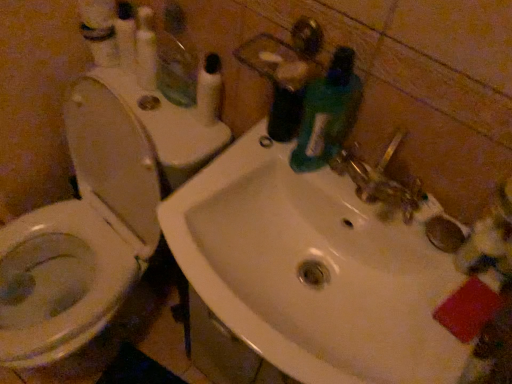
Question: In the image, is white plastic pump at upper center on the left side or the right side of clear glass mirror at upper left?

Choices:
 (A) left
 (B) right

Answer: (B)

Question: Considering the positions of point (217, 86) and point (158, 72), is point (217, 86) closer or farther from the camera than point (158, 72)?

Choices:
 (A) farther
 (B) closer

Answer: (B)

Question: Estimate the real-world distances between objects in this image. Which object is farther from the white plastic pump at upper center?

Choices:
 (A) green rubber gloves at sink
 (B) white glossy toilet at left
 (C) clear glass mirror at upper left
 (D) white glossy sink at center

Answer: (D)

Question: Estimate the real-world distances between objects in this image. Which object is closer to the white glossy toilet at left?

Choices:
 (A) clear glass mirror at upper left
 (B) green rubber gloves at sink
 (C) white glossy sink at center
 (D) white plastic pump at upper center

Answer: (A)